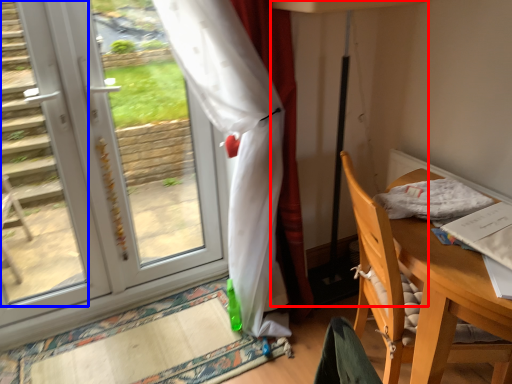
Question: Which point is further to the camera, table lamp (highlighted by a red box) or stair (highlighted by a blue box)?

Choices:
 (A) table lamp
 (B) stair

Answer: (A)